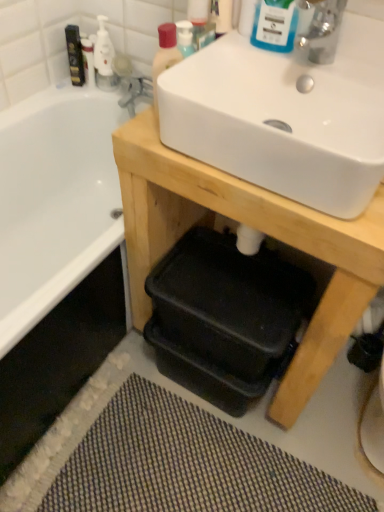
Image resolution: width=384 pixels, height=512 pixels. In order to click on free space to the left of blue glossy bottle at upper center, acting as the 1th mouthwash starting from the front in this screenshot , I will do `click(226, 47)`.